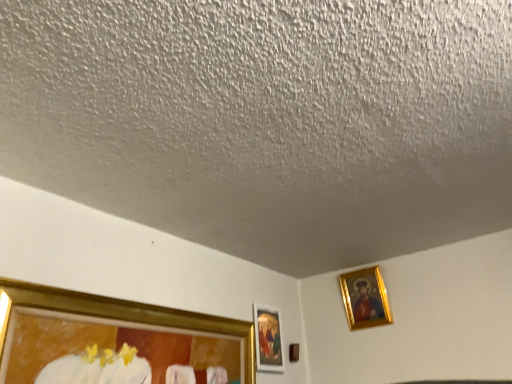
Question: Is gold metallic picture frame at upper right, positioned as the third picture frame in left-to-right order, wider or thinner than gold-framed painting at center, which appears as the 1th picture frame when viewed from the left?

Choices:
 (A) thin
 (B) wide

Answer: (B)

Question: Would you say gold metallic picture frame at upper right, positioned as the third picture frame in left-to-right order, is to the left or to the right of gold-framed painting at center, which appears as the 1th picture frame when viewed from the left, in the picture?

Choices:
 (A) right
 (B) left

Answer: (A)

Question: Estimate the real-world distances between objects in this image. Which object is closer to the gold-framed painting at center, which ranks as the third picture frame in right-to-left order?

Choices:
 (A) gold metallic picture frame at upper right, positioned as the 1th picture frame in right-to-left order
 (B) brown wooden picture frame at lower center, arranged as the second picture frame when viewed from the right

Answer: (B)

Question: Which object is the closest to the gold-framed painting at center, which ranks as the third picture frame in right-to-left order?

Choices:
 (A) brown wooden picture frame at lower center, the second picture frame in the left-to-right sequence
 (B) gold metallic picture frame at upper right, positioned as the 1th picture frame in right-to-left order

Answer: (A)